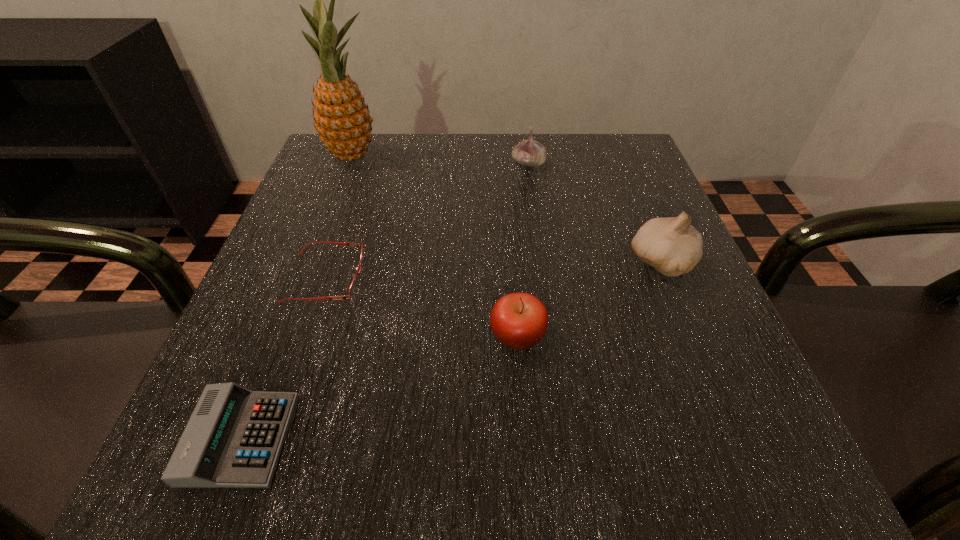
Where is `object at the right edge`? object at the right edge is located at coordinates (672, 246).

At what (x,y) coordinates should I click in order to perform the action: click on object situated at the far left corner. Please return your answer as a coordinate pair (x, y). Looking at the image, I should click on (342, 119).

Find the location of `object that is at the near left corner`. object that is at the near left corner is located at coordinates (233, 439).

Where is `vacant area at the far edge of the desktop`? Image resolution: width=960 pixels, height=540 pixels. vacant area at the far edge of the desktop is located at coordinates (465, 139).

In the image, there is a desktop. Identify the location of free space at the near edge. Image resolution: width=960 pixels, height=540 pixels. (464, 469).

This screenshot has height=540, width=960. What are the coordinates of `vacant space at the left edge of the desktop` in the screenshot? It's located at (324, 306).

Identify the location of vacant space at the right edge of the desktop. (672, 213).

At what (x,y) coordinates should I click in order to perform the action: click on free space at the near left corner of the desktop. Please return your answer as a coordinate pair (x, y). Image resolution: width=960 pixels, height=540 pixels. Looking at the image, I should click on (234, 494).

The width and height of the screenshot is (960, 540). I want to click on vacant area at the far right corner of the desktop, so click(613, 189).

In the image, there is a desktop. What are the coordinates of `vacant space at the near right corner` in the screenshot? It's located at (x=789, y=468).